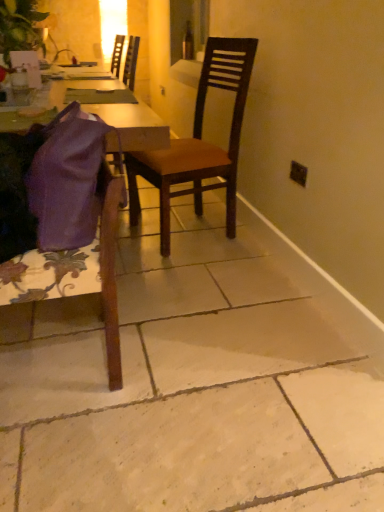
Image resolution: width=384 pixels, height=512 pixels. I want to click on free space in front of brown wooden chair at center, the 1th chair when ordered from back to front, so click(184, 268).